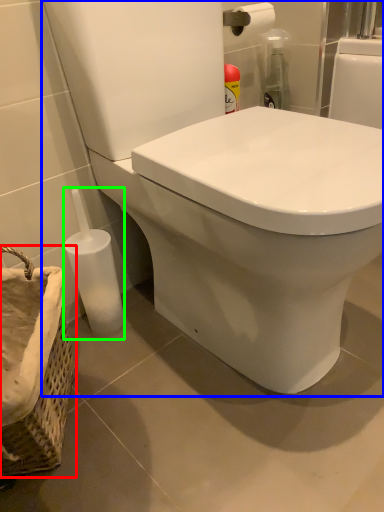
Question: Based on their relative distances, which object is farther from basket container (highlighted by a red box)? Choose from toilet (highlighted by a blue box) and bottle (highlighted by a green box).

Choices:
 (A) toilet
 (B) bottle

Answer: (A)